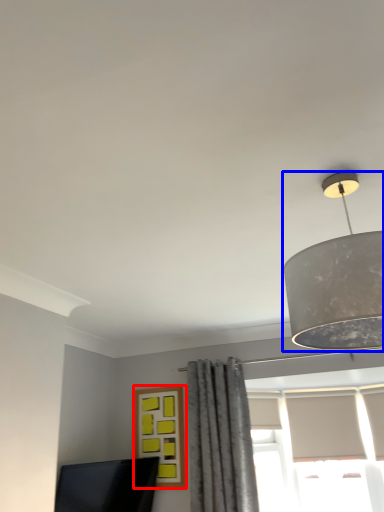
Question: Which of the following is the closest to the observer, window (highlighted by a red box) or lamp (highlighted by a blue box)?

Choices:
 (A) window
 (B) lamp

Answer: (B)